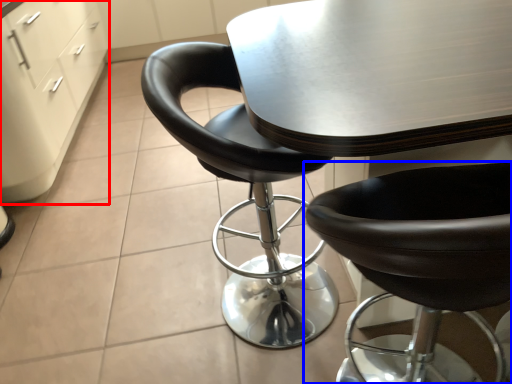
Question: Which object appears closest to the camera in this image, file cabinet (highlighted by a red box) or chair (highlighted by a blue box)?

Choices:
 (A) file cabinet
 (B) chair

Answer: (B)